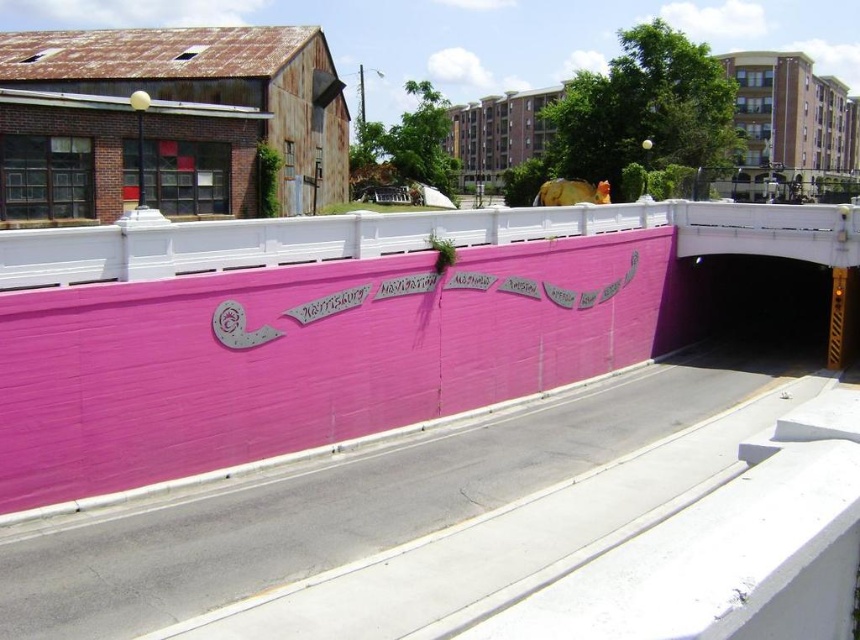
Question: Which of the following is the closest to the observer?

Choices:
 (A) pink concrete highway at center
 (B) pink painted wall at center

Answer: (A)

Question: Can you confirm if pink painted wall at center is positioned below pink concrete highway at center?

Choices:
 (A) no
 (B) yes

Answer: (A)

Question: Does pink painted wall at center have a lesser width compared to pink concrete highway at center?

Choices:
 (A) yes
 (B) no

Answer: (B)

Question: From the image, what is the correct spatial relationship of pink painted wall at center in relation to pink concrete highway at center?

Choices:
 (A) above
 (B) below

Answer: (A)

Question: Which point is closer to the camera?

Choices:
 (A) (115, 236)
 (B) (77, 608)

Answer: (B)

Question: Which object appears closest to the camera in this image?

Choices:
 (A) pink painted wall at center
 (B) pink concrete highway at center

Answer: (B)